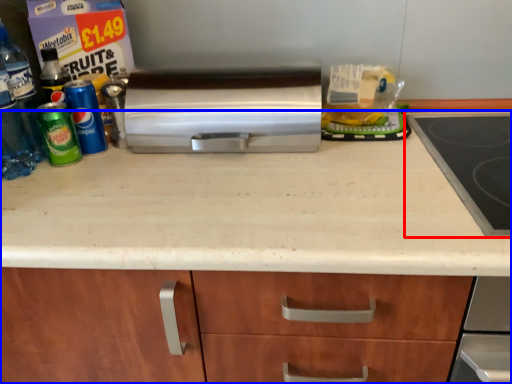
Question: Which point is further to the camera, gas stove (highlighted by a red box) or countertop (highlighted by a blue box)?

Choices:
 (A) gas stove
 (B) countertop

Answer: (A)